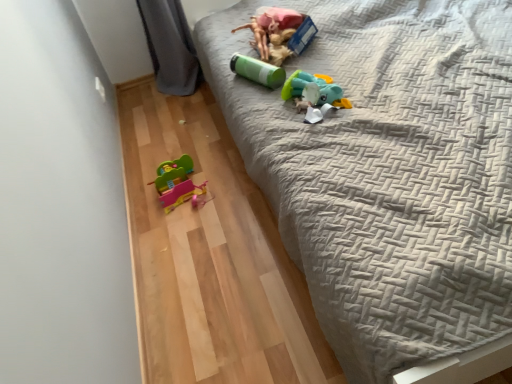
At what (x,y) coordinates should I click in order to perform the action: click on vacant space in front of matte plastic toy car at lower left, marked as the 1th toy in a bottom-to-top arrangement. Please return your answer as a coordinate pair (x, y). This screenshot has height=384, width=512. Looking at the image, I should click on (190, 231).